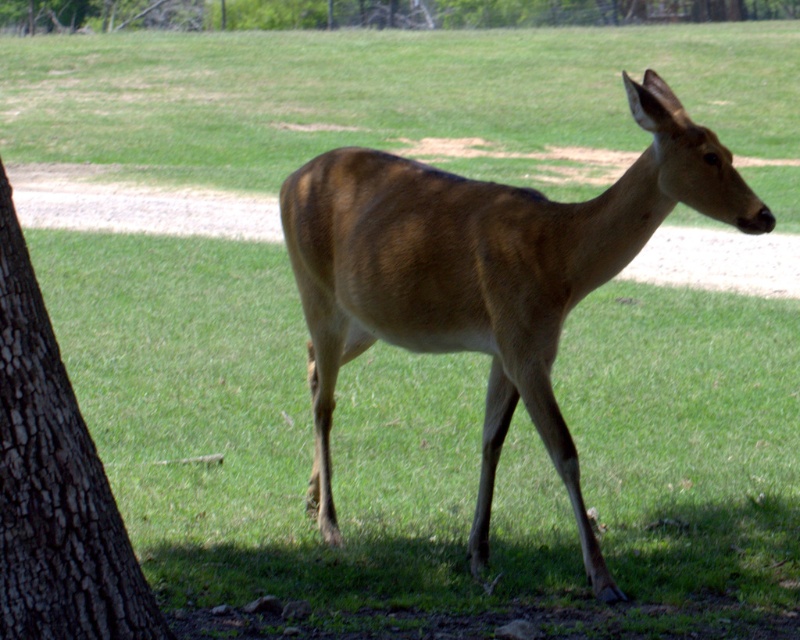
Can you confirm if brown matte/deer at center is wider than brown rough bark at upper center?

In fact, brown matte/deer at center might be narrower than brown rough bark at upper center.

Who is more distant from viewer, (440,227) or (724,10)?

A: The point (724,10) is behind.

Locate an element on the screen. brown matte/deer at center is located at coordinates (484, 276).

Between dark brown bark at left and brown rough bark at upper center, which one is positioned lower?

dark brown bark at left is below.

Is point (46, 492) farther from camera compared to point (4, 1)?

No.

Does point (20, 358) come behind point (58, 12)?

That is False.

I want to click on dark brown bark at left, so tap(54, 483).

Is point (308, 196) behind point (97, 493)?

Yes.

Can you confirm if brown matte/deer at center is smaller than dark brown bark at left?

No.

Does point (316, 384) come farther from viewer compared to point (64, 595)?

Yes, it is behind point (64, 595).

The height and width of the screenshot is (640, 800). Identify the location of brown matte/deer at center. (484, 276).